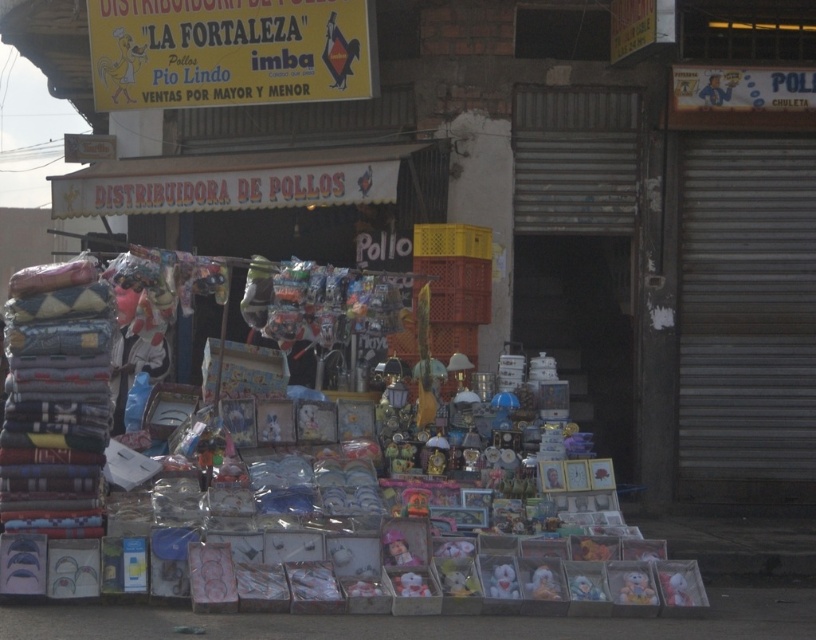
Question: Which point is farther to the camera?

Choices:
 (A) (420, 579)
 (B) (686, 592)

Answer: (B)

Question: Which point appears closest to the camera in this image?

Choices:
 (A) (664, 592)
 (B) (508, 572)
 (C) (646, 579)
 (D) (428, 595)

Answer: (D)

Question: Where is fluffy plush toy at lower center located in relation to plush toy at center in the image?

Choices:
 (A) right
 (B) left

Answer: (A)

Question: Which point is closer to the camera?

Choices:
 (A) plush pink doll at center
 (B) plush toy at center
 (C) soft plush bear at lower right
 (D) fluffy plush toy at lower center

Answer: (B)

Question: Is soft plush bear at lower right thinner than plush toy at center?

Choices:
 (A) yes
 (B) no

Answer: (A)

Question: Can you confirm if fluffy plush toy at lower center is positioned to the left of plush pink doll at center?

Choices:
 (A) yes
 (B) no

Answer: (B)